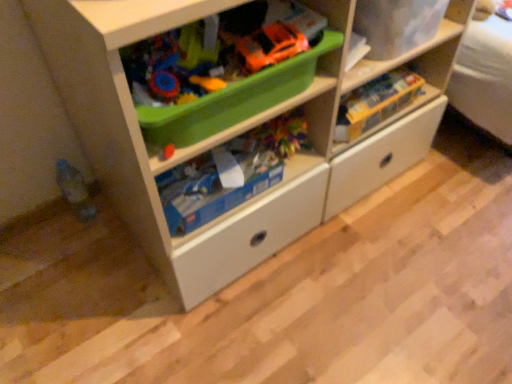
Question: Is matte plastic storage box at upper right behind orange matte toy car at upper center?

Choices:
 (A) no
 (B) yes

Answer: (B)

Question: Is matte plastic storage box at upper right completely or partially outside of orange matte toy car at upper center?

Choices:
 (A) yes
 (B) no

Answer: (A)

Question: Does matte plastic storage box at upper right turn towards orange matte toy car at upper center?

Choices:
 (A) yes
 (B) no

Answer: (B)

Question: Can you confirm if matte plastic storage box at upper right is positioned to the right of orange matte toy car at upper center?

Choices:
 (A) no
 (B) yes

Answer: (B)

Question: From the image's perspective, is matte plastic storage box at upper right on top of orange matte toy car at upper center?

Choices:
 (A) yes
 (B) no

Answer: (A)

Question: From a real-world perspective, is matte plastic storage box at upper right beneath orange matte toy car at upper center?

Choices:
 (A) no
 (B) yes

Answer: (B)

Question: Considering the relative sizes of green plastic container at upper center and white matte chest of drawers at center in the image provided, is green plastic container at upper center thinner than white matte chest of drawers at center?

Choices:
 (A) no
 (B) yes

Answer: (B)

Question: Considering the relative positions of green plastic container at upper center and white matte chest of drawers at center in the image provided, is green plastic container at upper center behind white matte chest of drawers at center?

Choices:
 (A) no
 (B) yes

Answer: (B)

Question: From the image's perspective, does green plastic container at upper center appear lower than white matte chest of drawers at center?

Choices:
 (A) no
 (B) yes

Answer: (B)

Question: Can you confirm if green plastic container at upper center is smaller than white matte chest of drawers at center?

Choices:
 (A) yes
 (B) no

Answer: (A)

Question: Is green plastic container at upper center touching white matte chest of drawers at center?

Choices:
 (A) no
 (B) yes

Answer: (A)

Question: Can you confirm if green plastic container at upper center is taller than white matte chest of drawers at center?

Choices:
 (A) yes
 (B) no

Answer: (B)

Question: Considering the relative sizes of white matte chest of drawers at center and matte plastic storage box at upper right in the image provided, is white matte chest of drawers at center taller than matte plastic storage box at upper right?

Choices:
 (A) no
 (B) yes

Answer: (B)